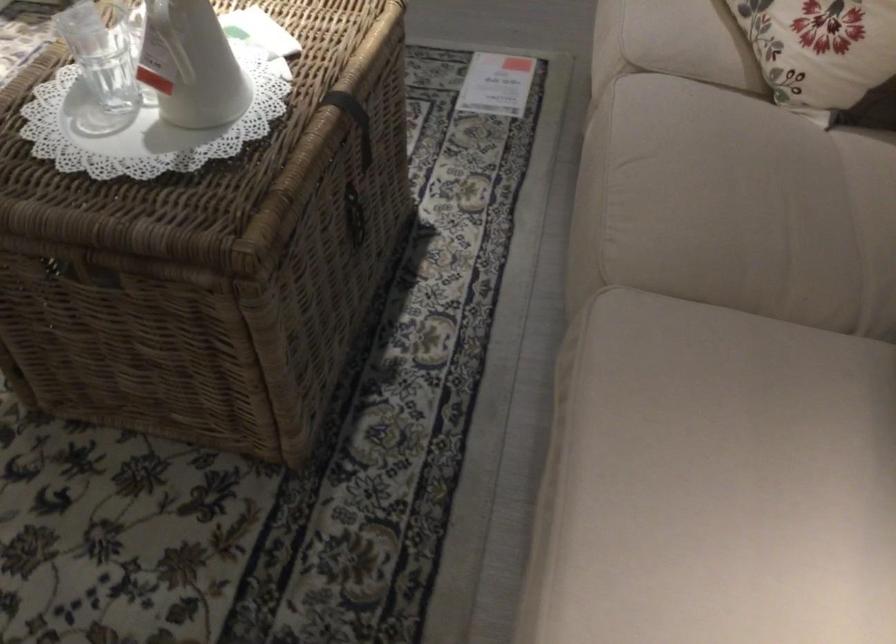
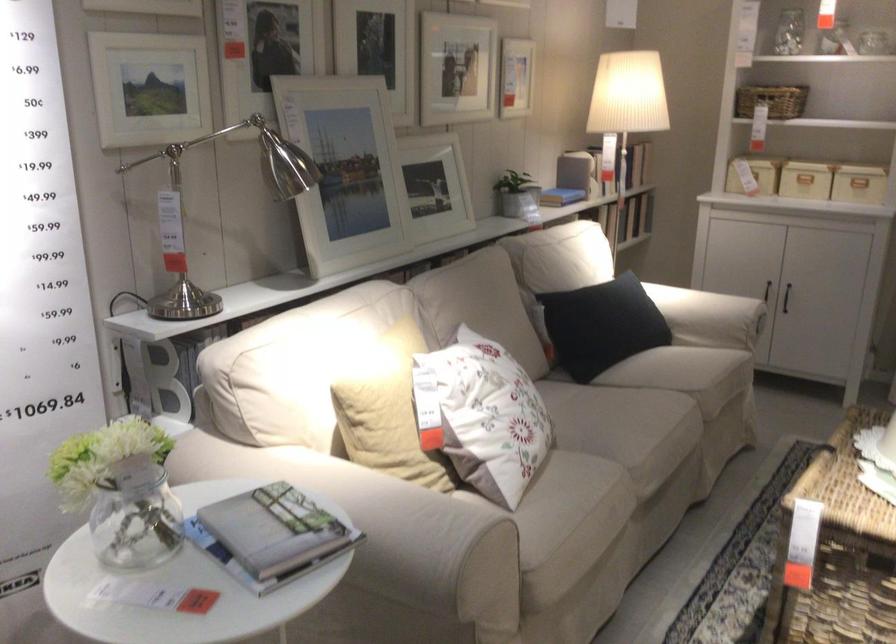
Where in the second image is the point corresponding to point 713,107 from the first image?

(596, 442)